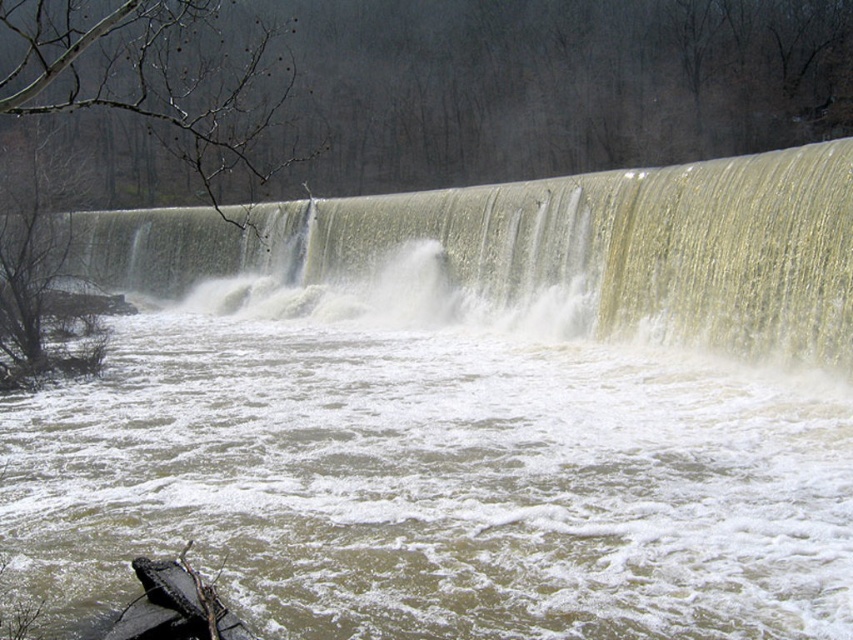
Looking at this image, you are standing at the edge of the waterfall and want to reach a point marked as point [466,252]. Given that the turbulent water flows at 2 meters per second, how long would it take you to float downstream to that point?

The distance between you and point [466,252] is 34.19 meters. Since the water flows at 2 meters per second, it would take 17.095 seconds to reach the point.